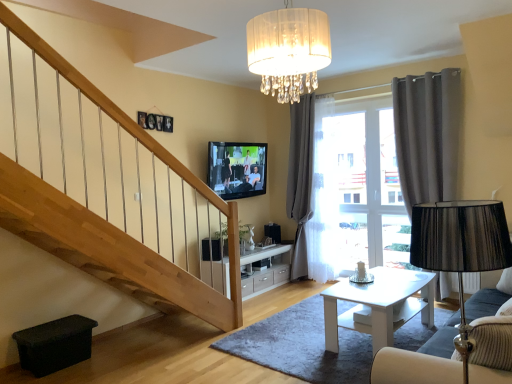
Question: Is the surface of dark gray fabric curtain at right, positioned as the 1th curtain in right-to-left order, in direct contact with flat screen tv at upper center?

Choices:
 (A) yes
 (B) no

Answer: (B)

Question: Is dark gray fabric curtain at right, positioned as the 1th curtain in right-to-left order, oriented away from flat screen tv at upper center?

Choices:
 (A) yes
 (B) no

Answer: (B)

Question: Is dark gray fabric curtain at right, which ranks as the 2th curtain in back-to-front order, bigger than flat screen tv at upper center?

Choices:
 (A) yes
 (B) no

Answer: (A)

Question: From a real-world perspective, is dark gray fabric curtain at right, which is counted as the 2th curtain, starting from the left, positioned over flat screen tv at upper center based on gravity?

Choices:
 (A) no
 (B) yes

Answer: (A)

Question: Considering the relative positions of dark gray fabric curtain at right, which is counted as the 2th curtain, starting from the left, and flat screen tv at upper center in the image provided, is dark gray fabric curtain at right, which is counted as the 2th curtain, starting from the left, to the left of flat screen tv at upper center from the viewer's perspective?

Choices:
 (A) yes
 (B) no

Answer: (B)

Question: Considering the positions of white sheer curtain at center, the 2th curtain positioned from the right, and white glossy coffee table at center in the image, is white sheer curtain at center, the 2th curtain positioned from the right, bigger or smaller than white glossy coffee table at center?

Choices:
 (A) big
 (B) small

Answer: (A)

Question: From the image's perspective, relative to white glossy coffee table at center, is white sheer curtain at center, which is the 2th curtain in front-to-back order, above or below?

Choices:
 (A) below
 (B) above

Answer: (B)

Question: Considering the positions of white sheer curtain at center, the 2th curtain positioned from the right, and white glossy coffee table at center in the image, is white sheer curtain at center, the 2th curtain positioned from the right, taller or shorter than white glossy coffee table at center?

Choices:
 (A) tall
 (B) short

Answer: (A)

Question: Is white sheer curtain at center, which is the 1th curtain from back to front, situated inside white glossy coffee table at center or outside?

Choices:
 (A) inside
 (B) outside

Answer: (B)

Question: Considering the positions of point (304, 155) and point (218, 142), is point (304, 155) closer or farther from the camera than point (218, 142)?

Choices:
 (A) farther
 (B) closer

Answer: (A)

Question: In terms of size, does white sheer curtain at center, acting as the 1th curtain starting from the left, appear bigger or smaller than flat screen tv at upper center?

Choices:
 (A) small
 (B) big

Answer: (B)

Question: Would you say white sheer curtain at center, which is the 2th curtain in front-to-back order, is inside or outside flat screen tv at upper center?

Choices:
 (A) outside
 (B) inside

Answer: (A)

Question: From the image's perspective, is white sheer curtain at center, which is the 2th curtain in front-to-back order, located above or below flat screen tv at upper center?

Choices:
 (A) below
 (B) above

Answer: (A)

Question: In terms of size, does translucent fabric chandelier at upper center appear bigger or smaller than velvet blue sofa at lower right?

Choices:
 (A) small
 (B) big

Answer: (A)

Question: In the image, is translucent fabric chandelier at upper center on the left side or the right side of velvet blue sofa at lower right?

Choices:
 (A) left
 (B) right

Answer: (A)